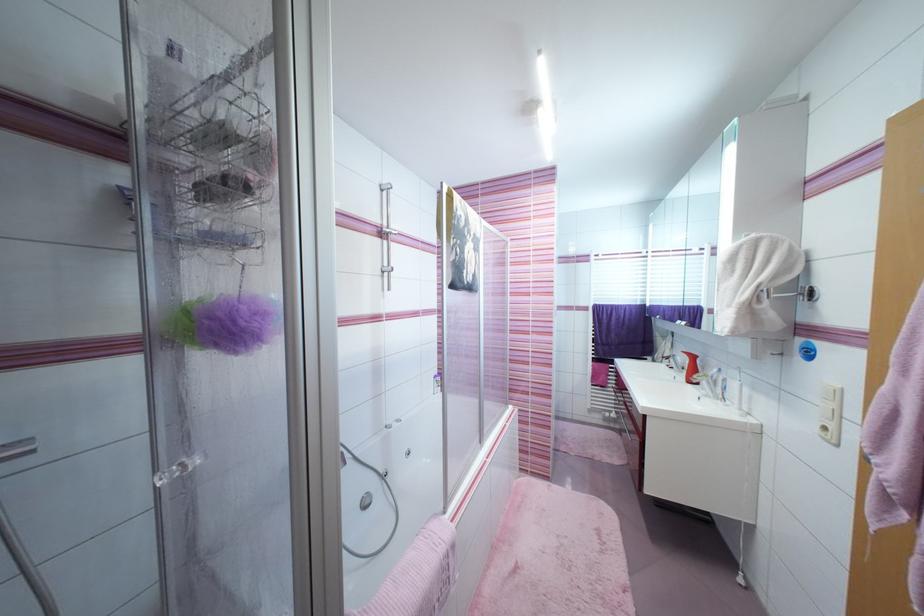
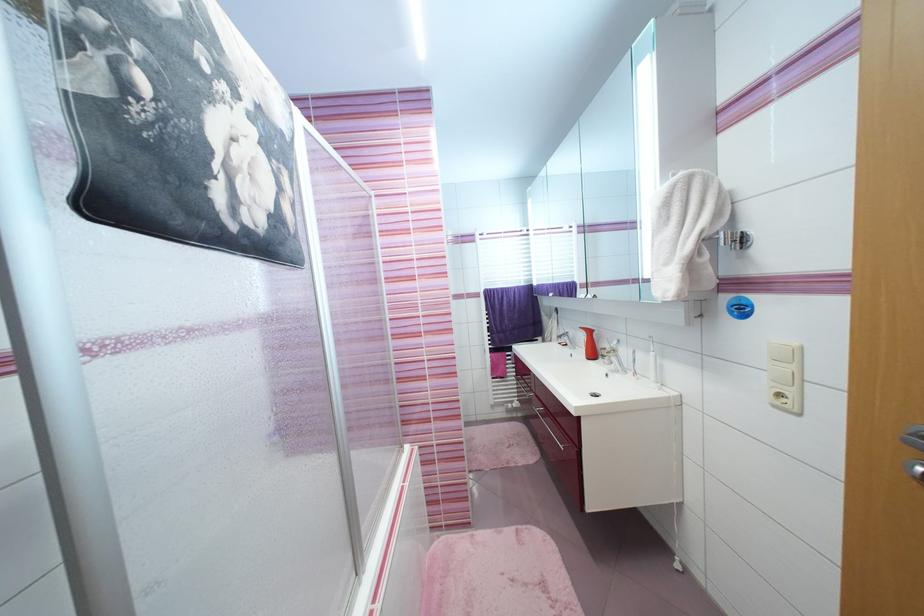
Question: The camera is either moving clockwise (left) or counter-clockwise (right) around the object. The first image is from the beginning of the video and the second image is from the end. Is the camera moving left or right when shooting the video?

Choices:
 (A) Left
 (B) Right

Answer: (A)